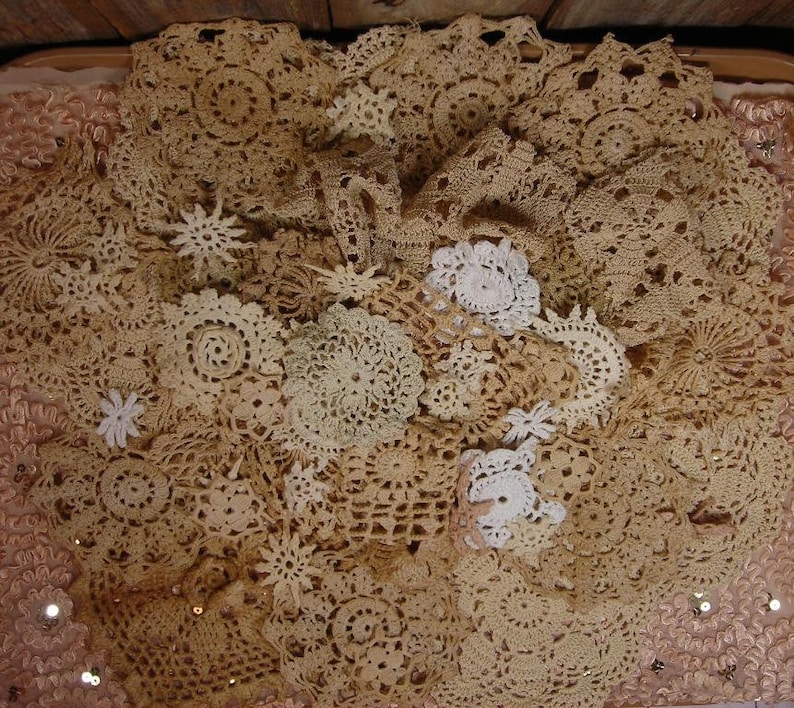
You are a GUI agent. You are given a task and a screenshot of the screen. Output one action in this format:
    pyautogui.click(x=<x>, y=<y>)
    Task: Click on the grey doily
    The image size is (794, 708).
    Given the screenshot: What is the action you would take?
    pyautogui.click(x=332, y=377)